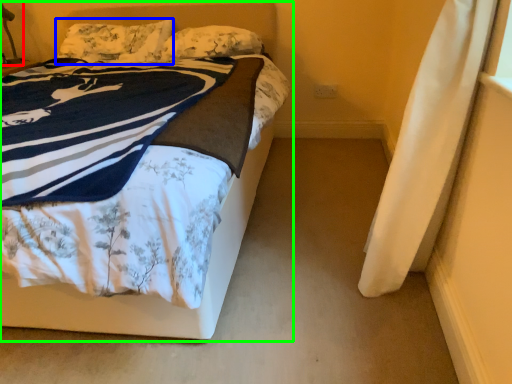
Question: Which object is the closest to the table lamp (highlighted by a red box)? Choose among these: pillow (highlighted by a blue box) or bed (highlighted by a green box).

Choices:
 (A) pillow
 (B) bed

Answer: (A)